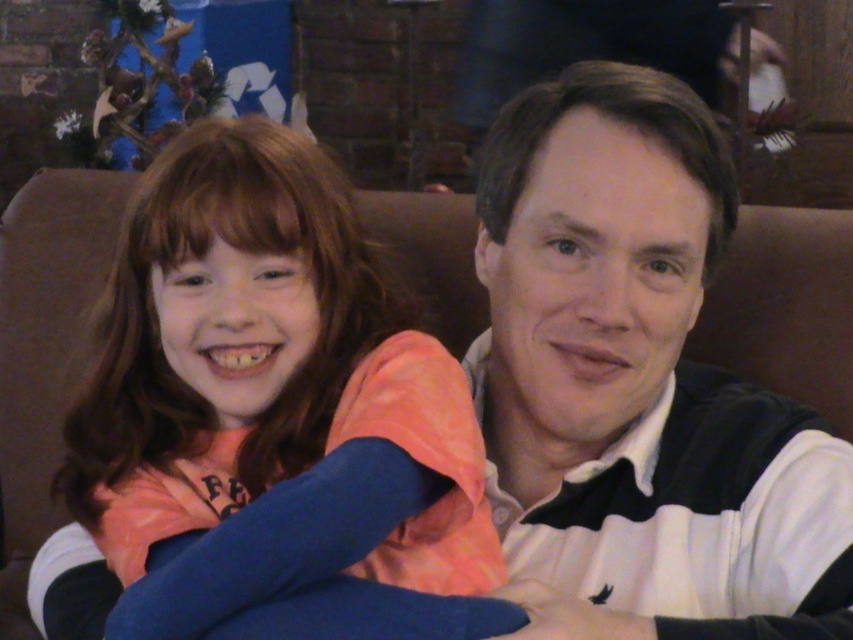
You are trying to decide which sweater to take home. Both the orange fleece sweater at left and the white striped sweater at center are in front of you. Which one is shorter in height?

The orange fleece sweater at left is shorter in height compared to the white striped sweater at center.

You are a photographer trying to capture a candid shot of the orange fleece sweater at left and the white striped sweater at center. Which sweater will appear larger in the photo if you focus on the one closer to you?

The orange fleece sweater at left will appear larger in the photo because it is in front of the white striped sweater at center, making it closer to the camera.